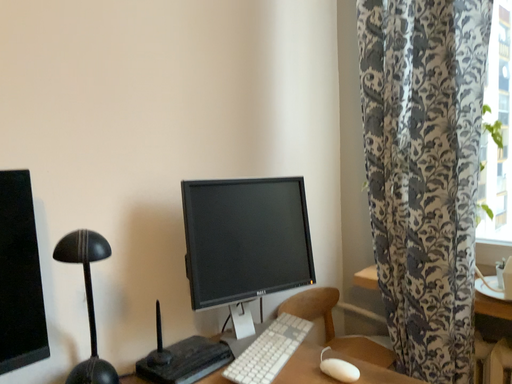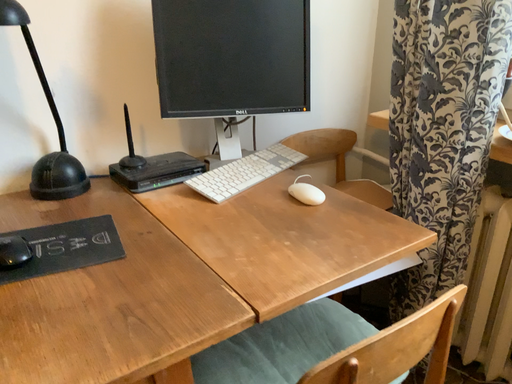
Question: Which way did the camera rotate in the video?

Choices:
 (A) rotated right
 (B) rotated left

Answer: (B)